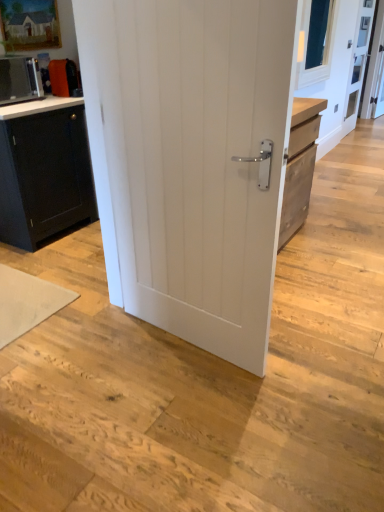
Question: From a real-world perspective, is white matte yoga mat at lower left positioned over white glossy countertop at upper left based on gravity?

Choices:
 (A) yes
 (B) no

Answer: (B)

Question: From the image's perspective, does white matte yoga mat at lower left appear lower than white glossy countertop at upper left?

Choices:
 (A) yes
 (B) no

Answer: (A)

Question: Can you confirm if white matte yoga mat at lower left is positioned to the right of white glossy countertop at upper left?

Choices:
 (A) yes
 (B) no

Answer: (A)

Question: Does white matte yoga mat at lower left have a smaller size compared to white glossy countertop at upper left?

Choices:
 (A) yes
 (B) no

Answer: (A)

Question: From a real-world perspective, is white matte yoga mat at lower left positioned under white glossy countertop at upper left based on gravity?

Choices:
 (A) no
 (B) yes

Answer: (B)

Question: Is point (360, 78) positioned closer to the camera than point (52, 304)?

Choices:
 (A) farther
 (B) closer

Answer: (A)

Question: Is clear glass screen door at upper right situated inside white matte yoga mat at lower left or outside?

Choices:
 (A) outside
 (B) inside

Answer: (A)

Question: From the image's perspective, relative to white matte yoga mat at lower left, is clear glass screen door at upper right above or below?

Choices:
 (A) above
 (B) below

Answer: (A)

Question: From a real-world perspective, is clear glass screen door at upper right positioned above or below white matte yoga mat at lower left?

Choices:
 (A) above
 (B) below

Answer: (A)

Question: Looking at the image, does clear glass screen door at upper right seem bigger or smaller compared to white glossy countertop at upper left?

Choices:
 (A) big
 (B) small

Answer: (A)

Question: Is point (344, 119) positioned closer to the camera than point (13, 109)?

Choices:
 (A) farther
 (B) closer

Answer: (A)

Question: From a real-world perspective, is clear glass screen door at upper right positioned above or below white glossy countertop at upper left?

Choices:
 (A) above
 (B) below

Answer: (B)

Question: Considering the positions of clear glass screen door at upper right and white glossy countertop at upper left in the image, is clear glass screen door at upper right taller or shorter than white glossy countertop at upper left?

Choices:
 (A) tall
 (B) short

Answer: (A)

Question: From a real-world perspective, is white painted wood door at center above or below matte black microwave at left?

Choices:
 (A) below
 (B) above

Answer: (A)

Question: In terms of width, does white painted wood door at center look wider or thinner when compared to matte black microwave at left?

Choices:
 (A) wide
 (B) thin

Answer: (B)